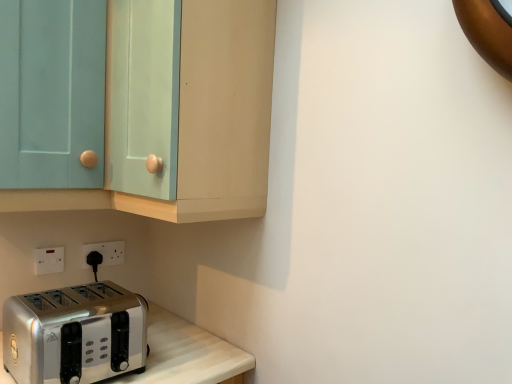
Question: Is matte teal cabinet at upper left turned away from white plastic electric outlet at lower left, which is the first electric outlet in back-to-front order?

Choices:
 (A) no
 (B) yes

Answer: (A)

Question: Is matte teal cabinet at upper left located outside white plastic electric outlet at lower left, marked as the 2th electric outlet in a left-to-right arrangement?

Choices:
 (A) yes
 (B) no

Answer: (A)

Question: Considering the relative sizes of matte teal cabinet at upper left and white plastic electric outlet at lower left, marked as the 2th electric outlet in a left-to-right arrangement, in the image provided, is matte teal cabinet at upper left wider than white plastic electric outlet at lower left, marked as the 2th electric outlet in a left-to-right arrangement,?

Choices:
 (A) yes
 (B) no

Answer: (A)

Question: Is matte teal cabinet at upper left at the right side of white plastic electric outlet at lower left, the first electric outlet when ordered from right to left?

Choices:
 (A) yes
 (B) no

Answer: (A)

Question: From the image's perspective, would you say matte teal cabinet at upper left is positioned over white plastic electric outlet at lower left, marked as the 2th electric outlet in a left-to-right arrangement?

Choices:
 (A) no
 (B) yes

Answer: (B)

Question: Is white plastic electric outlet at lower left, the second electric outlet positioned from the back, taller or shorter than light blue glass door at upper left?

Choices:
 (A) short
 (B) tall

Answer: (A)

Question: Considering the positions of white plastic electric outlet at lower left, the 1th electric outlet when ordered from front to back, and light blue glass door at upper left in the image, is white plastic electric outlet at lower left, the 1th electric outlet when ordered from front to back, wider or thinner than light blue glass door at upper left?

Choices:
 (A) wide
 (B) thin

Answer: (B)

Question: Considering the positions of point (40, 251) and point (28, 24), is point (40, 251) closer or farther from the camera than point (28, 24)?

Choices:
 (A) closer
 (B) farther

Answer: (B)

Question: In the image, is white plastic electric outlet at lower left, the 1th electric outlet when ordered from front to back, on the left side or the right side of light blue glass door at upper left?

Choices:
 (A) right
 (B) left

Answer: (B)

Question: Considering the positions of white plastic electric outlet at lower left, the first electric outlet when ordered from right to left, and light blue glass door at upper left in the image, is white plastic electric outlet at lower left, the first electric outlet when ordered from right to left, wider or thinner than light blue glass door at upper left?

Choices:
 (A) thin
 (B) wide

Answer: (A)

Question: In terms of height, does white plastic electric outlet at lower left, which is the first electric outlet in back-to-front order, look taller or shorter compared to light blue glass door at upper left?

Choices:
 (A) short
 (B) tall

Answer: (A)

Question: Relative to light blue glass door at upper left, is white plastic electric outlet at lower left, placed as the second electric outlet when sorted from front to back, in front or behind?

Choices:
 (A) behind
 (B) front

Answer: (A)

Question: Would you say white plastic electric outlet at lower left, marked as the 2th electric outlet in a left-to-right arrangement, is to the left or to the right of light blue glass door at upper left in the picture?

Choices:
 (A) right
 (B) left

Answer: (A)

Question: Is point (61, 296) closer or farther from the camera than point (4, 140)?

Choices:
 (A) farther
 (B) closer

Answer: (A)

Question: From a real-world perspective, is satin silver toaster at lower left above or below light blue glass door at upper left?

Choices:
 (A) below
 (B) above

Answer: (A)